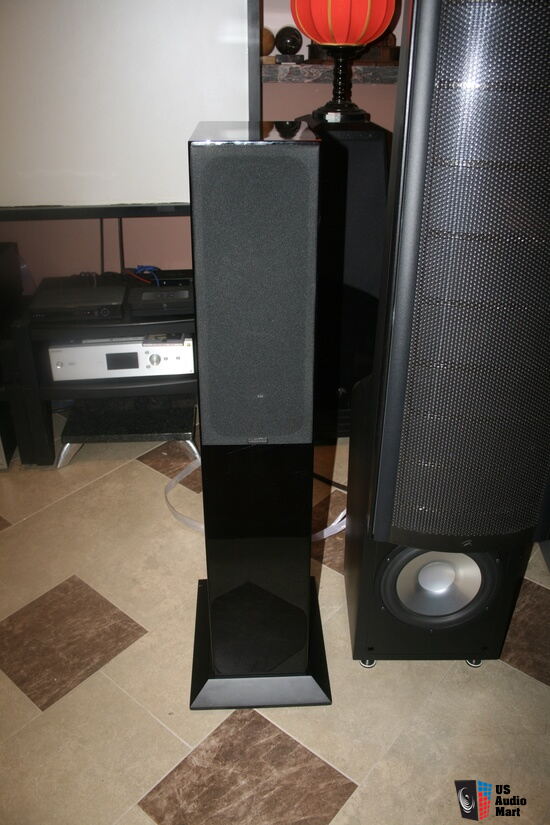
Locate an element on the screen. small black tv stand is located at coordinates (37, 423).